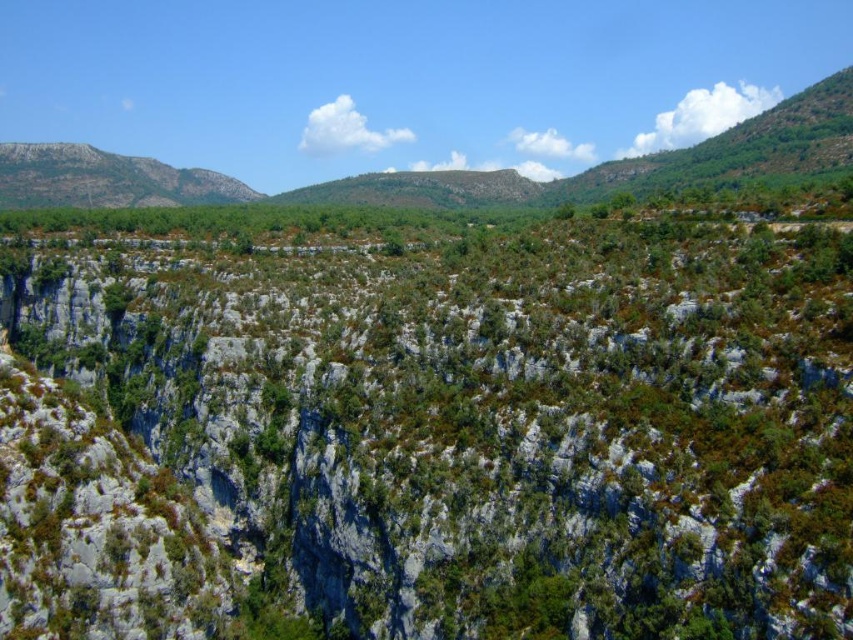
Consider the image. You are a hiker planning to climb the gray rocky mountain at upper left and want to know if the green leafy shrub at center is blocking your path. Can you determine if the shrub is in the way of the mountain?

The green leafy shrub at center is positioned under the gray rocky mountain at upper left, so it is located below the mountain and not directly blocking the path to it.

You are a hiker standing at the base of the mountain looking towards the dense forest. You notice two points marked on your map. Which of the two points, point (341,310) or point (70,192), is closer to your current position?

Point (341,310) is closer to the camera than point (70,192), so it is closer to your current position.